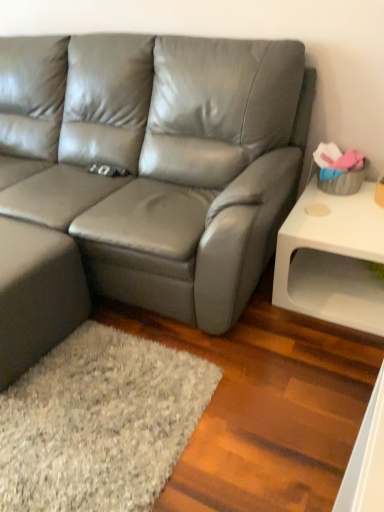
The image size is (384, 512). In order to click on satin gray leather couch at center in this screenshot , I will do `click(159, 181)`.

The width and height of the screenshot is (384, 512). What do you see at coordinates (159, 181) in the screenshot?
I see `satin gray leather couch at center` at bounding box center [159, 181].

What do you see at coordinates (332, 259) in the screenshot? Image resolution: width=384 pixels, height=512 pixels. I see `white matte side table at right` at bounding box center [332, 259].

Locate an element on the screen. The width and height of the screenshot is (384, 512). white matte side table at right is located at coordinates (332, 259).

I want to click on satin gray leather couch at center, so click(159, 181).

Which is more to the left, white matte side table at right or satin gray leather couch at center?

From the viewer's perspective, satin gray leather couch at center appears more on the left side.

In the image, is white matte side table at right positioned in front of or behind satin gray leather couch at center?

white matte side table at right is behind satin gray leather couch at center.

Which point is more forward, (325, 196) or (222, 191)?

The point (222, 191) is closer to the camera.

From the image's perspective, is white matte side table at right located above or below satin gray leather couch at center?

white matte side table at right is below satin gray leather couch at center.

From a real-world perspective, between white matte side table at right and satin gray leather couch at center, who is vertically lower?

In real-world perspective, white matte side table at right is lower.

Can you confirm if white matte side table at right is wider than satin gray leather couch at center?

No.

Is white matte side table at right shorter than satin gray leather couch at center?

Yes, white matte side table at right is shorter than satin gray leather couch at center.

Is white matte side table at right smaller than satin gray leather couch at center?

Yes, white matte side table at right is smaller than satin gray leather couch at center.

Is white matte side table at right spatially inside satin gray leather couch at center, or outside of it?

white matte side table at right is not inside satin gray leather couch at center, it's outside.

Is white matte side table at right next to satin gray leather couch at center?

white matte side table at right and satin gray leather couch at center are not in contact.

Is white matte side table at right positioned with its back to satin gray leather couch at center?

No, white matte side table at right is not facing the opposite direction of satin gray leather couch at center.

Identify the location of table lying on the right of satin gray leather couch at center. Image resolution: width=384 pixels, height=512 pixels. (332, 259).

Which object is positioned more to the left, satin gray leather couch at center or white matte side table at right?

satin gray leather couch at center is more to the left.

Is satin gray leather couch at center positioned behind white matte side table at right?

No, it is in front of white matte side table at right.

Is point (266, 166) in front of point (346, 206)?

Yes.

From the image's perspective, is satin gray leather couch at center beneath white matte side table at right?

No, from the image's perspective, satin gray leather couch at center is not below white matte side table at right.

From a real-world perspective, between satin gray leather couch at center and white matte side table at right, who is vertically higher?

From a 3D spatial view, satin gray leather couch at center is above.

Which object is thinner, satin gray leather couch at center or white matte side table at right?

white matte side table at right is thinner.

Between satin gray leather couch at center and white matte side table at right, which one has more height?

With more height is satin gray leather couch at center.

Who is smaller, satin gray leather couch at center or white matte side table at right?

white matte side table at right.

Would you say satin gray leather couch at center is inside or outside white matte side table at right?

satin gray leather couch at center exists outside the volume of white matte side table at right.

Can you see satin gray leather couch at center touching white matte side table at right?

No.

Is satin gray leather couch at center oriented away from white matte side table at right?

No, satin gray leather couch at center's orientation is not away from white matte side table at right.

How different are the orientations of satin gray leather couch at center and white matte side table at right in degrees?

The facing directions of satin gray leather couch at center and white matte side table at right are 0.000221 degrees apart.

The width and height of the screenshot is (384, 512). Find the location of `studio couch above the white matte side table at right (from the image's perspective)`. studio couch above the white matte side table at right (from the image's perspective) is located at coordinates (159, 181).

Locate an element on the screen. The image size is (384, 512). table below the satin gray leather couch at center (from a real-world perspective) is located at coordinates (332, 259).

Identify the location of studio couch that appears in front of the white matte side table at right. The image size is (384, 512). (159, 181).